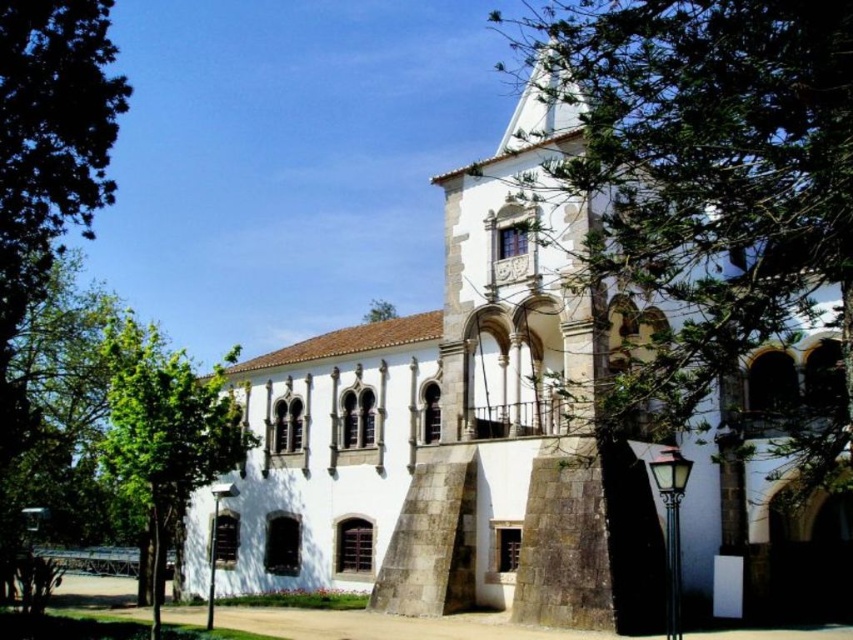
Question: Estimate the real-world distances between objects in this image. Which object is closer to the green leafy tree at upper center?

Choices:
 (A) white stone church at center
 (B) green leafy tree at upper right
 (C) green leafy tree at center

Answer: (C)

Question: Estimate the real-world distances between objects in this image. Which object is farther from the green leafy tree at left?

Choices:
 (A) green leafy tree at upper center
 (B) green leafy tree at center
 (C) green leafy tree at upper right

Answer: (A)

Question: Can you confirm if green leafy tree at upper right is positioned below green leafy tree at left?

Choices:
 (A) no
 (B) yes

Answer: (A)

Question: Observing the image, what is the correct spatial positioning of green leafy tree at upper right in reference to green leafy tree at upper center?

Choices:
 (A) below
 (B) above

Answer: (B)

Question: Does green leafy tree at upper right have a lesser width compared to green leafy tree at upper center?

Choices:
 (A) yes
 (B) no

Answer: (B)

Question: Estimate the real-world distances between objects in this image. Which object is farther from the green leafy tree at left?

Choices:
 (A) green leafy tree at upper center
 (B) white stone church at center
 (C) green leafy tree at upper right

Answer: (A)